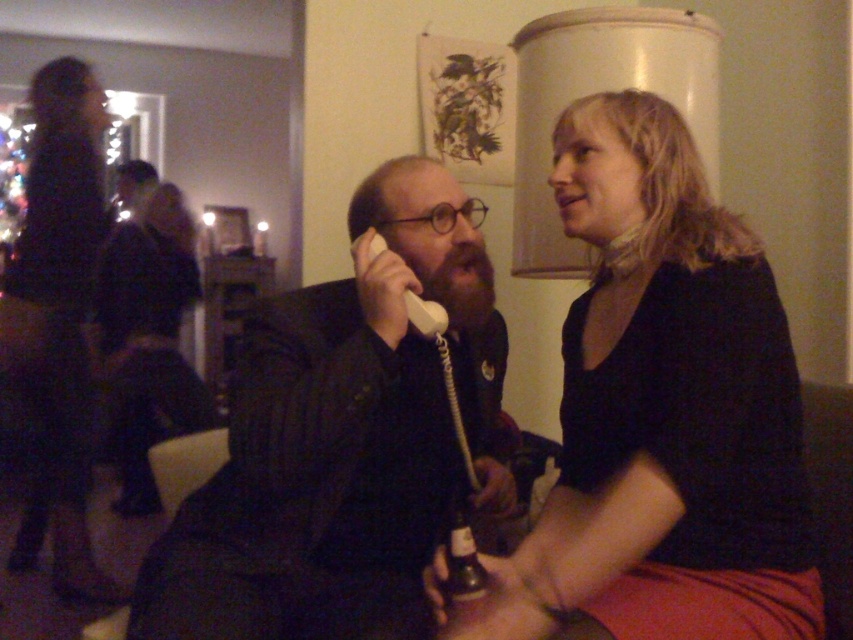
Find the location of a particular element. The height and width of the screenshot is (640, 853). matte black shirt at center is located at coordinates (663, 412).

Between point (627, 540) and point (457, 364), which one is positioned in front?

Point (627, 540) is in front.

Image resolution: width=853 pixels, height=640 pixels. In order to click on matte black shirt at center in this screenshot , I will do `click(663, 412)`.

Does matte black phone at center lie in front of dark fabric dress at left?

Yes.

Which of these two, matte black phone at center or dark fabric dress at left, stands shorter?

Standing shorter between the two is matte black phone at center.

Does point (206, 563) come behind point (48, 202)?

No, it is in front of (48, 202).

Locate an element on the screen. matte black phone at center is located at coordinates (341, 438).

Does matte black shirt at center have a lesser width compared to dark fabric dress at left?

Yes, matte black shirt at center is thinner than dark fabric dress at left.

You are a GUI agent. You are given a task and a screenshot of the screen. Output one action in this format:
    pyautogui.click(x=<x>, y=<y>)
    Task: Click on the matte black shirt at center
    This screenshot has width=853, height=640.
    Given the screenshot: What is the action you would take?
    pyautogui.click(x=663, y=412)

Is point (811, 611) farther from camera compared to point (68, 209)?

No, it is in front of (68, 209).

Find the location of `matte black shirt at center`. matte black shirt at center is located at coordinates (663, 412).